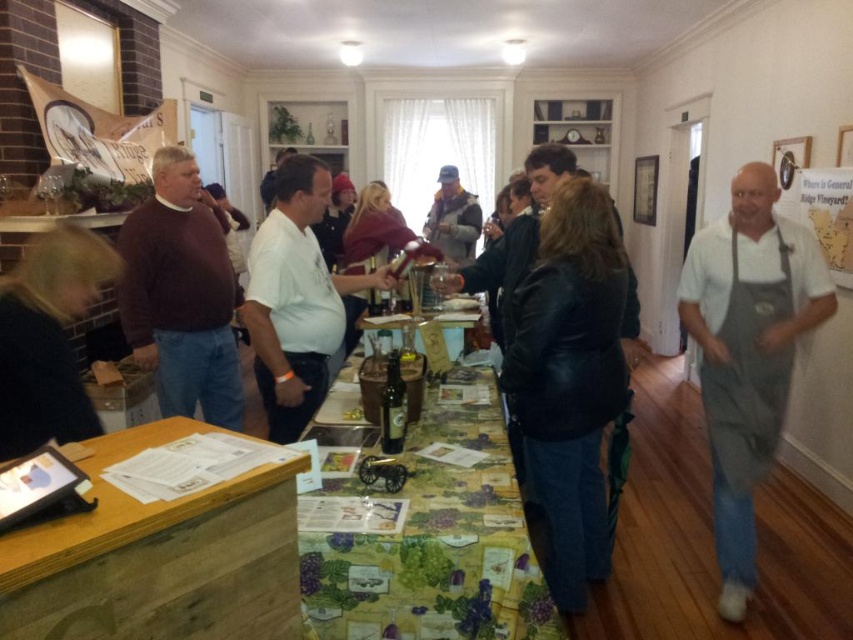
You are a guest at the wine tasting event and want to place your brown sweater at left on the wooden table at lower left. Will the sweater fit on the table?

The wooden table at lower left has a lesser height compared to brown sweater at left, so the sweater may not fit properly on the table due to the height difference.

Based on the photo, you are standing at the entrance of the wine tasting event and see two points marked on the floor. The first point is at coordinate point(294, 368) and the second point is at coordinate point(456, 204). Which point is closer to you?

Result: Point(294, 368) is in front of point(456, 204), so it is closer to you.